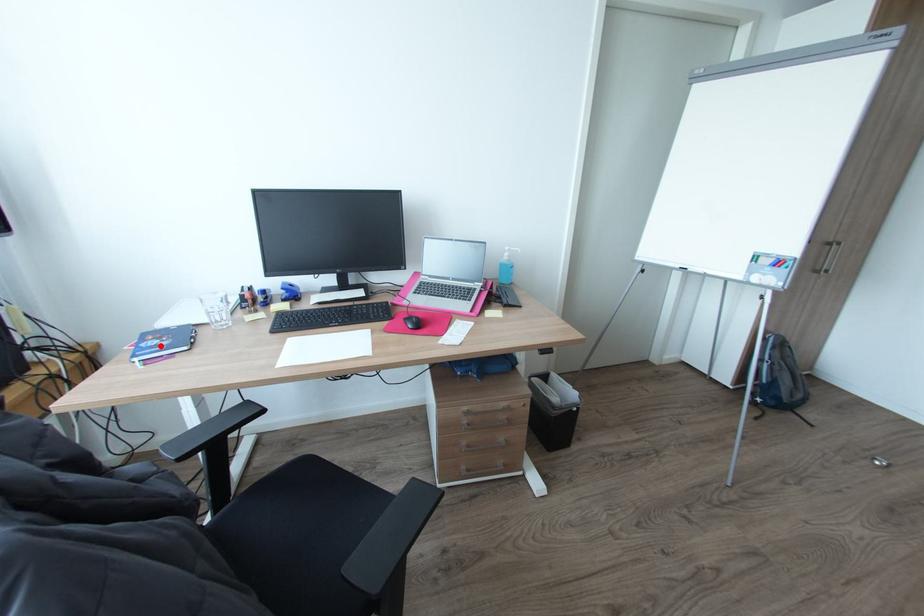
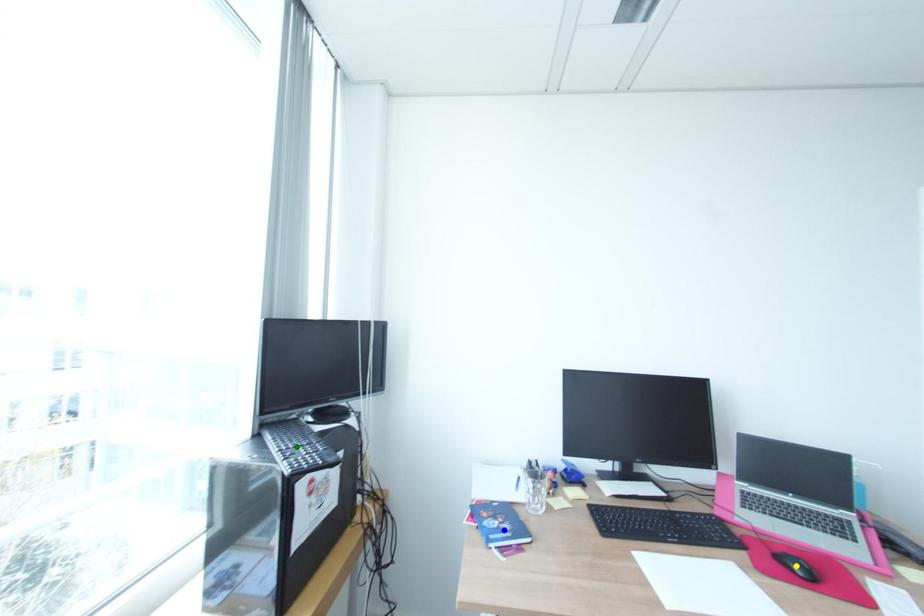
Question: I am providing you with two images of the same scene from different viewpoints. A red point is marked on the first image. You are given multiple points on the second image. In image 2, which mark is for the same physical point as the one in image 1?

Choices:
 (A) green point
 (B) blue point
 (C) yellow point

Answer: (B)